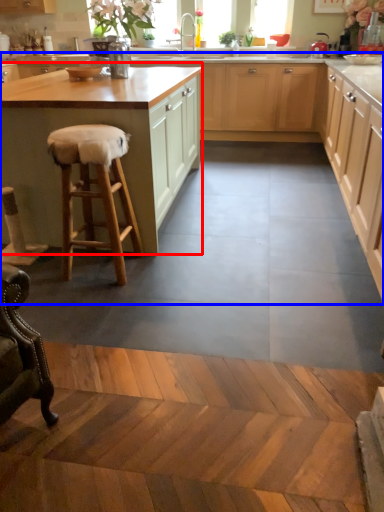
Question: Which point is further to the camera, cabinetry (highlighted by a red box) or cabinetry (highlighted by a blue box)?

Choices:
 (A) cabinetry
 (B) cabinetry

Answer: (A)